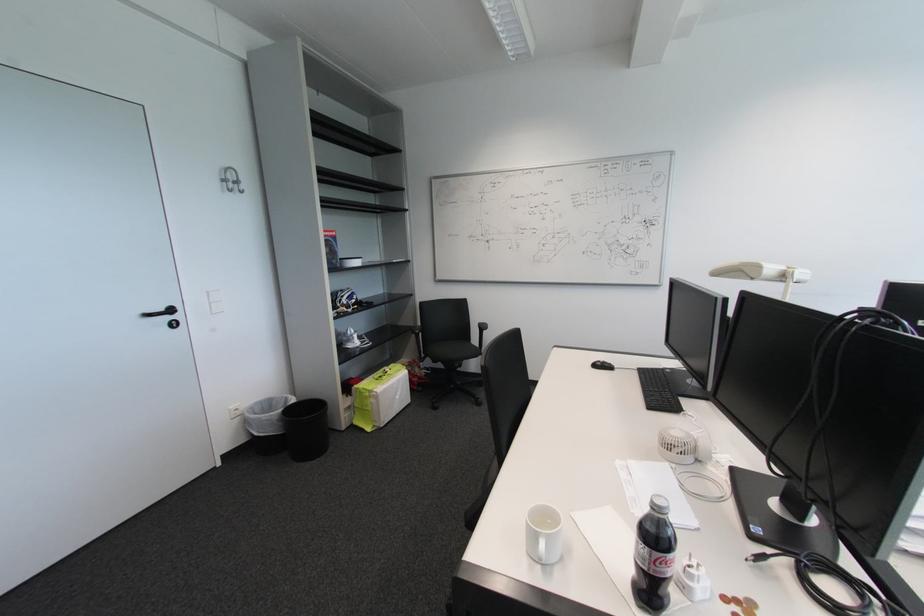
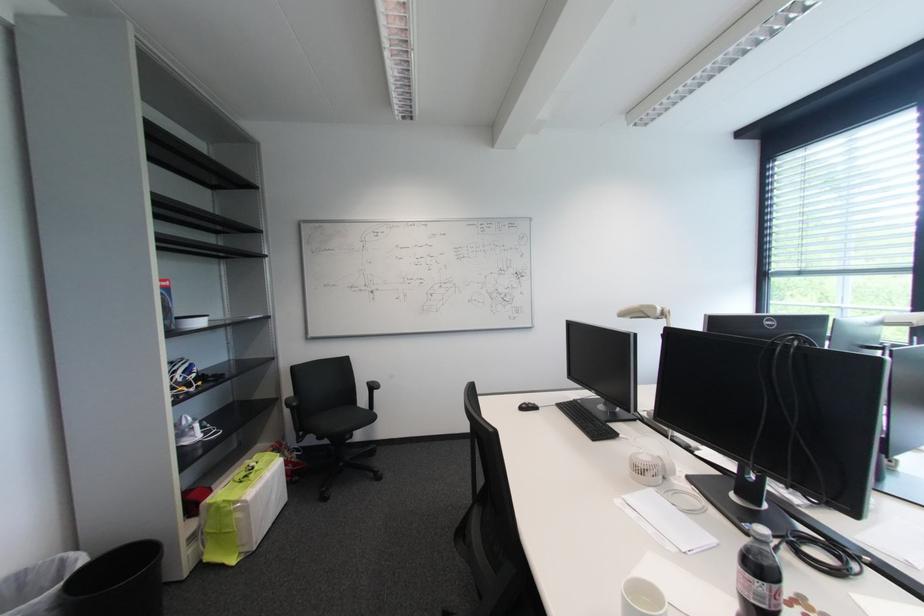
In the second image, find the point that corresponds to point (604, 365) in the first image.

(530, 408)